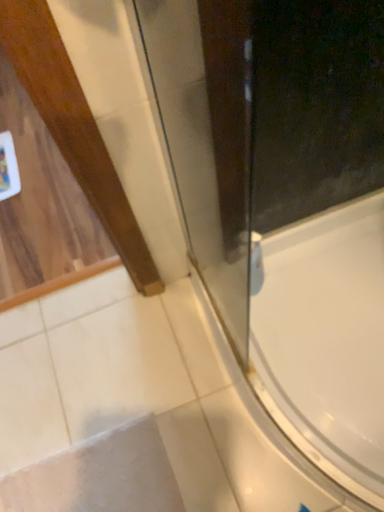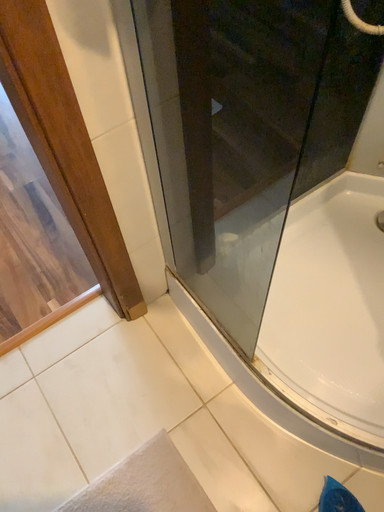
Question: How did the camera likely rotate when shooting the video?

Choices:
 (A) rotated left
 (B) rotated right

Answer: (B)